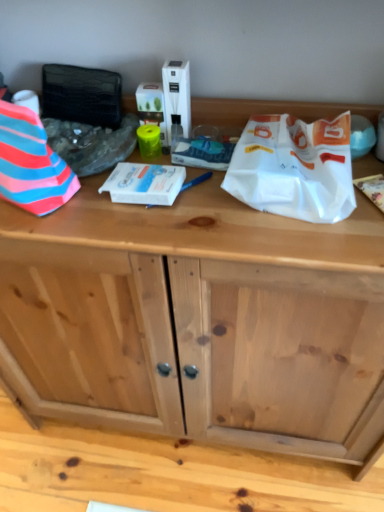
Question: From a real-world perspective, is striped fabric at left, which is the 1th wrapping paper in left-to-right order, positioned above or below white paper bag at upper right, the 3th wrapping paper positioned from the left?

Choices:
 (A) above
 (B) below

Answer: (A)

Question: Considering the positions of point (6, 142) and point (231, 173), is point (6, 142) closer or farther from the camera than point (231, 173)?

Choices:
 (A) farther
 (B) closer

Answer: (B)

Question: Estimate the real-world distances between objects in this image. Which object is farther from the white paper bag at upper right, which appears as the first wrapping paper when viewed from the right?

Choices:
 (A) striped fabric at left, arranged as the third wrapping paper when viewed from the right
 (B) white glossy box at center, the second wrapping paper positioned from the left

Answer: (A)

Question: Which object is positioned farthest from the white paper bag at upper right, which appears as the first wrapping paper when viewed from the right?

Choices:
 (A) striped fabric at left, arranged as the third wrapping paper when viewed from the right
 (B) white glossy box at center, the second wrapping paper positioned from the left

Answer: (A)